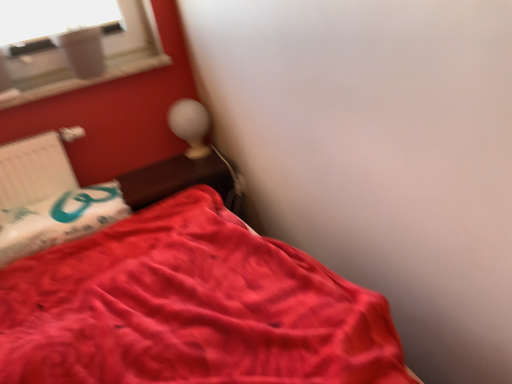
Question: Does wooden table at upper center appear on the left side of satin red bed at lower left?

Choices:
 (A) no
 (B) yes

Answer: (B)

Question: Can you confirm if wooden table at upper center is smaller than satin red bed at lower left?

Choices:
 (A) no
 (B) yes

Answer: (B)

Question: Does wooden table at upper center appear on the right side of satin red bed at lower left?

Choices:
 (A) yes
 (B) no

Answer: (B)

Question: Can you confirm if wooden table at upper center is shorter than satin red bed at lower left?

Choices:
 (A) no
 (B) yes

Answer: (B)

Question: From the image's perspective, is wooden table at upper center located beneath satin red bed at lower left?

Choices:
 (A) yes
 (B) no

Answer: (B)

Question: Can you confirm if wooden table at upper center is wider than satin red bed at lower left?

Choices:
 (A) yes
 (B) no

Answer: (B)

Question: Does satin red bed at lower left lie behind white plastic radiator at left?

Choices:
 (A) yes
 (B) no

Answer: (B)

Question: From the image's perspective, does satin red bed at lower left appear lower than white plastic radiator at left?

Choices:
 (A) yes
 (B) no

Answer: (A)

Question: Is satin red bed at lower left taller than white plastic radiator at left?

Choices:
 (A) no
 (B) yes

Answer: (B)

Question: Is white plastic radiator at left inside satin red bed at lower left?

Choices:
 (A) no
 (B) yes

Answer: (A)

Question: Would you say satin red bed at lower left is outside white plastic radiator at left?

Choices:
 (A) yes
 (B) no

Answer: (A)

Question: Is satin red bed at lower left far from white plastic radiator at left?

Choices:
 (A) yes
 (B) no

Answer: (B)

Question: Does white plastic radiator at left lie in front of matte white table lamp at upper center?

Choices:
 (A) no
 (B) yes

Answer: (B)